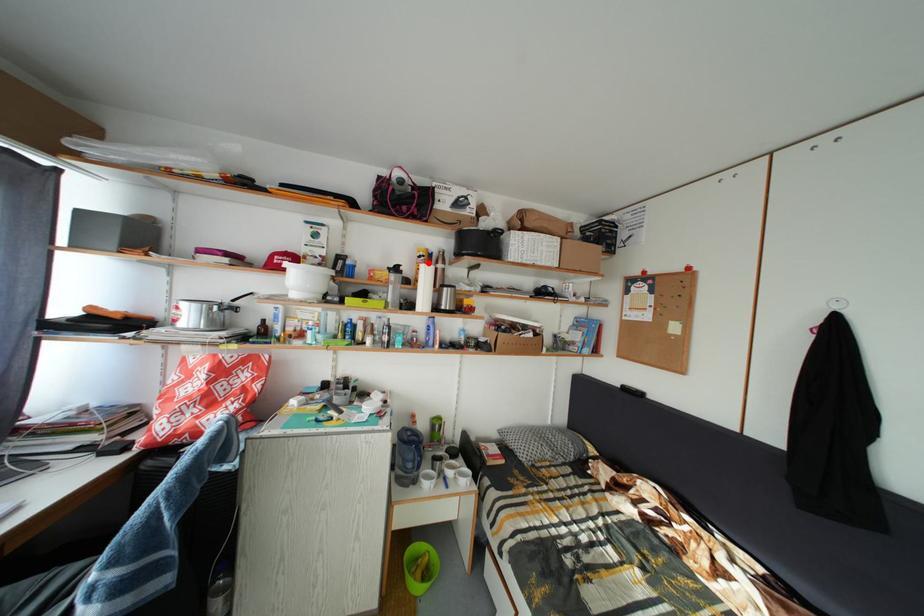
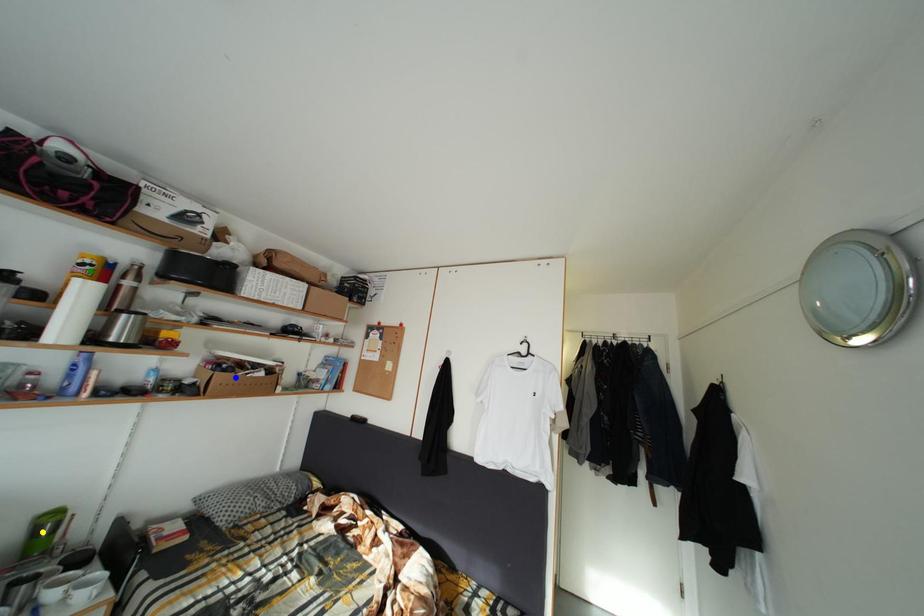
Question: I am providing you with two images of the same scene from different viewpoints. A red point is marked on the first image. You are given multiple points on the second image. Which mark in image 2 goes with the point in image 1?

Choices:
 (A) blue point
 (B) green point
 (C) yellow point

Answer: (B)